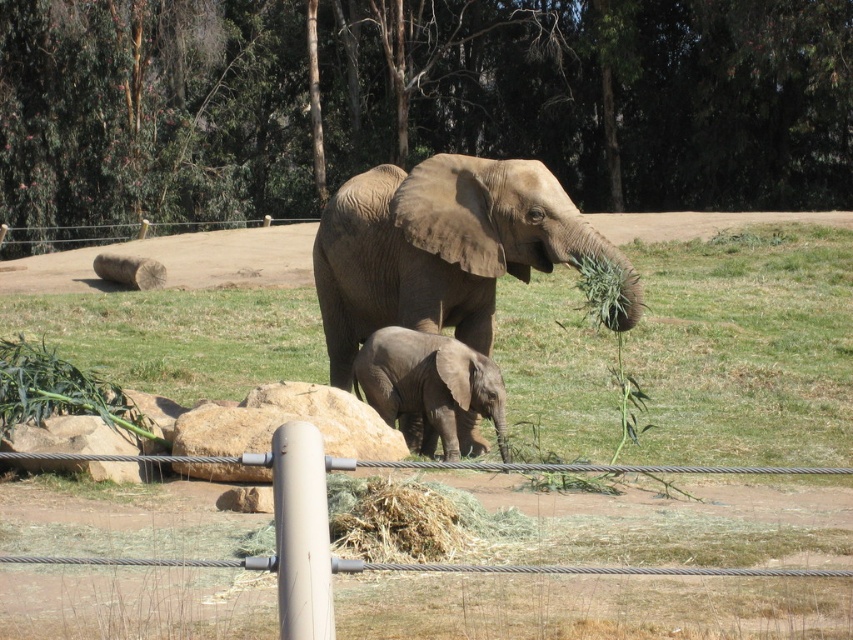
You are a visitor at the zoo and want to take a photo of the gray textured elephant at center and the green leafy tree at upper center. Based on their positions, will the tree appear to the left or right side of the elephant in the photo?

The green leafy tree at upper center is positioned to the left of the gray textured elephant at center, so in the photo, the tree will appear on the left side of the elephant.

You are standing at the point marked as point (x=405, y=216) in the image. The enclosure fence is 10 feet away from you. Can you see the entire zoo enclosure from your current position?

The distance between you and the point (x=405, y=216) is 44.04 feet. Since the enclosure fence is only 10 feet away from you, you are outside the enclosure and cannot see the entire zoo enclosure from your current position.

You are a zookeeper who needs to place a divider between the gray textured elephant at center and the gray matte elephant at center to separate them for feeding. The divider you have is 80 centimeters wide. Will the divider fit between them without overlapping either elephant?

The gray textured elephant at center and the gray matte elephant at center are 85.14 centimeters apart. Since the divider is 80 centimeters wide, there will be a 5.14 centimeter gap remaining between the divider and each elephant. Therefore, the divider can be placed between them without overlapping either elephant.